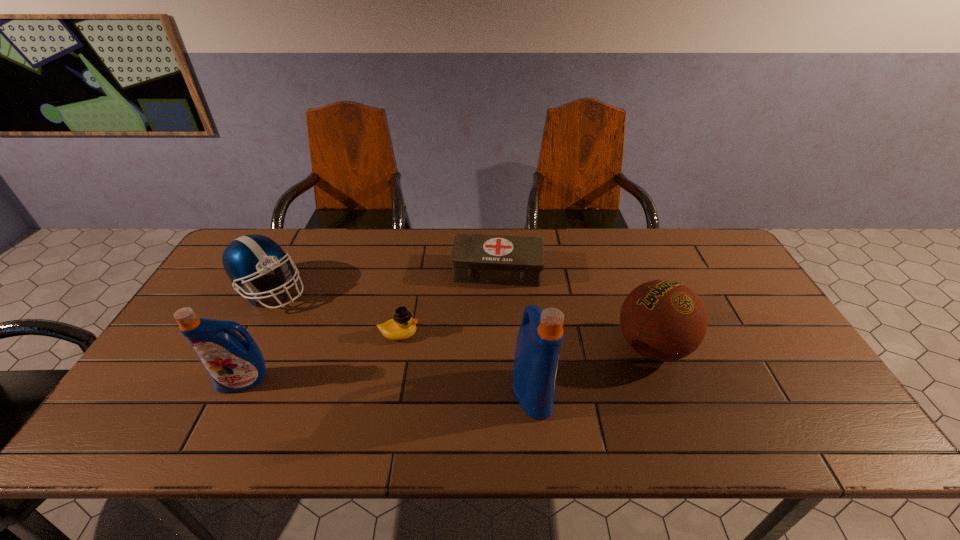
Identify the location of the second tallest object. (234, 364).

Locate an element on the screen. This screenshot has width=960, height=540. the left detergent is located at coordinates (234, 364).

Where is `the right detergent`? the right detergent is located at coordinates (540, 336).

What are the coordinates of `the tallest object` in the screenshot? It's located at (540, 336).

Locate an element on the screen. The width and height of the screenshot is (960, 540). the first-aid kit is located at coordinates (480, 259).

Locate an element on the screen. The height and width of the screenshot is (540, 960). duck is located at coordinates (402, 326).

Where is `football helmet`? This screenshot has height=540, width=960. football helmet is located at coordinates pyautogui.click(x=248, y=257).

This screenshot has width=960, height=540. Find the location of `the rightmost object`. the rightmost object is located at coordinates pos(663,320).

I want to click on free space located on the label of the right detergent, so click(x=580, y=392).

You are a GUI agent. You are given a task and a screenshot of the screen. Output one action in this format:
    pyautogui.click(x=<x>, y=<y>)
    Task: Click on the vacant space located 0.300m on the left of the first-aid kit
    The height and width of the screenshot is (540, 960).
    Given the screenshot: What is the action you would take?
    pyautogui.click(x=358, y=271)